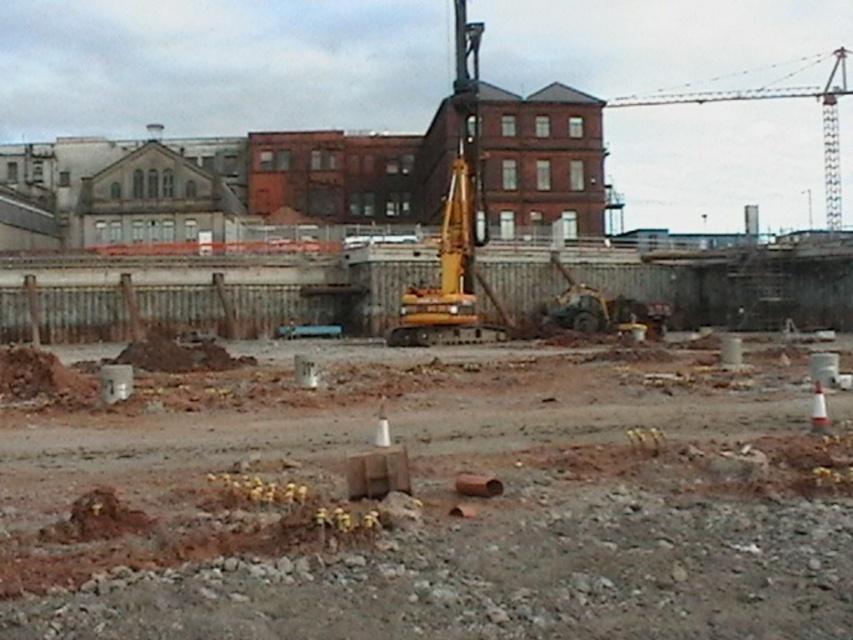
Question: Considering the relative positions of yellow rubber excavator at center and yellow metallic crane at upper right in the image provided, where is yellow rubber excavator at center located with respect to yellow metallic crane at upper right?

Choices:
 (A) above
 (B) below

Answer: (B)

Question: Does brown gravel at center appear on the left side of yellow metallic crane at upper right?

Choices:
 (A) no
 (B) yes

Answer: (B)

Question: Which object is the farthest from the yellow rubber excavator at center?

Choices:
 (A) brown gravel at center
 (B) yellow metallic crane at upper right

Answer: (B)

Question: Which point is farther to the camera?

Choices:
 (A) brown gravel at center
 (B) yellow rubber excavator at center

Answer: (B)

Question: Does yellow rubber excavator at center have a greater width compared to yellow metallic crane at upper right?

Choices:
 (A) yes
 (B) no

Answer: (B)

Question: Which point appears closest to the camera in this image?

Choices:
 (A) 569,436
 (B) 825,173

Answer: (A)